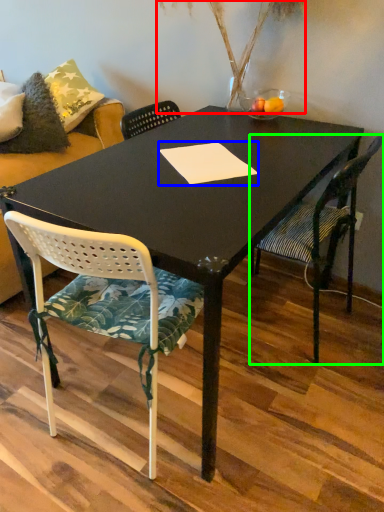
Question: Which object is positioned farthest from plant (highlighted by a red box)? Select from notepad (highlighted by a blue box) and chair (highlighted by a green box).

Choices:
 (A) notepad
 (B) chair

Answer: (B)